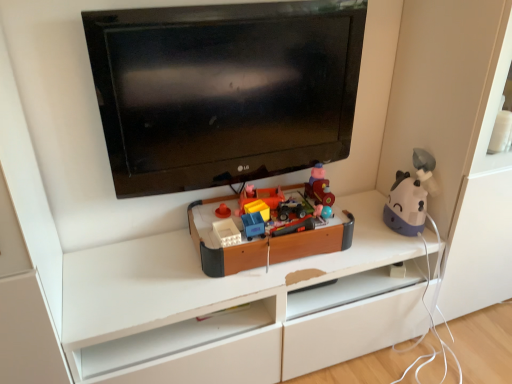
Question: Is point (401, 198) positioned closer to the camera than point (282, 210)?

Choices:
 (A) farther
 (B) closer

Answer: (A)

Question: In the image, is purple matte humidifier at right, which ranks as the 3th toy in left-to-right order, positioned in front of or behind wooden toy box at center, arranged as the first toy when viewed from the left?

Choices:
 (A) front
 (B) behind

Answer: (B)

Question: Estimate the real-world distances between objects in this image. Which object is farther from the black glossy tv at upper center?

Choices:
 (A) purple matte humidifier at right, which appears as the first toy when viewed from the right
 (B) wooden toy box at center, arranged as the first toy when viewed from the left
 (C) wooden toy train at center, the second toy viewed from the left

Answer: (A)

Question: Which object is positioned farthest from the wooden toy train at center, the second toy viewed from the left?

Choices:
 (A) black glossy tv at upper center
 (B) wooden toy box at center, which is the third toy from right to left
 (C) purple matte humidifier at right, which ranks as the 3th toy in left-to-right order

Answer: (A)